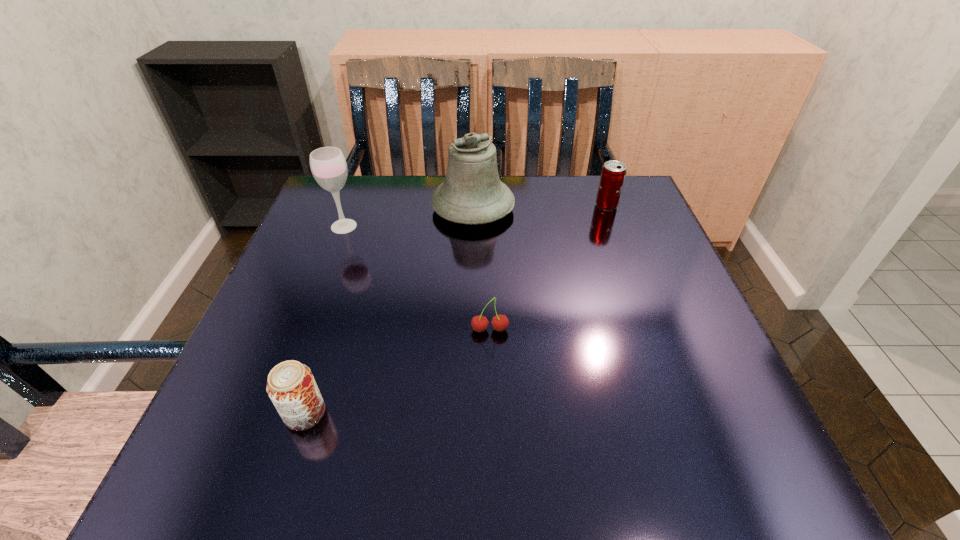
You are a GUI agent. You are given a task and a screenshot of the screen. Output one action in this format:
    pyautogui.click(x=<x>, y=<y>)
    Task: Click on the object that is at the far left corner
    The width and height of the screenshot is (960, 540).
    Given the screenshot: What is the action you would take?
    pyautogui.click(x=328, y=165)

This screenshot has width=960, height=540. What are the coordinates of `object positioned at the near left corner` in the screenshot? It's located at (291, 386).

Image resolution: width=960 pixels, height=540 pixels. What are the coordinates of `object present at the far right corner` in the screenshot? It's located at (613, 173).

I want to click on free space at the far edge of the desktop, so click(x=524, y=210).

In the image, there is a desktop. Identify the location of free space at the near edge. (439, 449).

In the image, there is a desktop. Find the location of `free space at the left edge`. free space at the left edge is located at coordinates (289, 265).

At what (x,y) coordinates should I click in order to perform the action: click on vacant space at the right edge of the desktop. Please return your answer as a coordinate pair (x, y). Image resolution: width=960 pixels, height=540 pixels. Looking at the image, I should click on (664, 347).

Identify the location of vacant space at the far left corner. This screenshot has width=960, height=540. (331, 205).

You are a GUI agent. You are given a task and a screenshot of the screen. Output one action in this format:
    pyautogui.click(x=<x>, y=<y>)
    Task: Click on the vacant space at the near left corner
    
    Given the screenshot: What is the action you would take?
    [x=188, y=484]

Find the location of a particular element. free point at the far right corner is located at coordinates (637, 195).